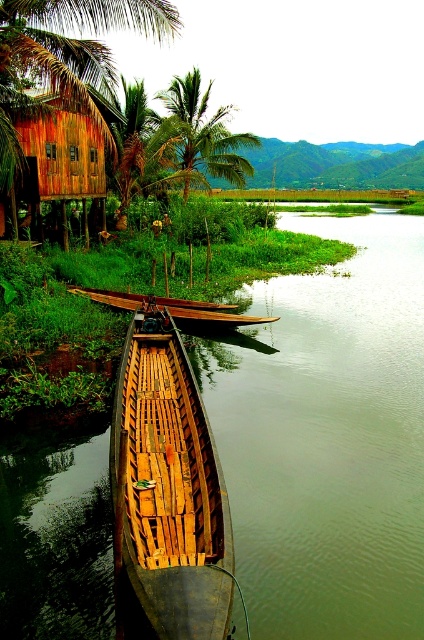
Question: Which object appears closest to the camera in this image?

Choices:
 (A) wooden planks boat at lower left
 (B) wooden canoe at center
 (C) greenish-brown wooden boat at lower center

Answer: (A)

Question: Which of these objects is positioned closest to the brown wooden palm tree at upper left?

Choices:
 (A) greenish-brown wooden boat at lower center
 (B) wooden hut at upper left
 (C) wooden planks boat at lower left

Answer: (B)

Question: Is wooden planks boat at lower left to the left of wooden canoe at center from the viewer's perspective?

Choices:
 (A) yes
 (B) no

Answer: (B)

Question: Is greenish-brown wooden boat at lower center closer to camera compared to brown wooden palm tree at upper left?

Choices:
 (A) no
 (B) yes

Answer: (B)

Question: Is brown wooden palm tree at upper left smaller than wooden hut at upper left?

Choices:
 (A) no
 (B) yes

Answer: (B)

Question: Among these points, which one is nearest to the camera?

Choices:
 (A) (75, 289)
 (B) (167, 96)
 (C) (139, 637)
 (D) (35, 131)

Answer: (C)